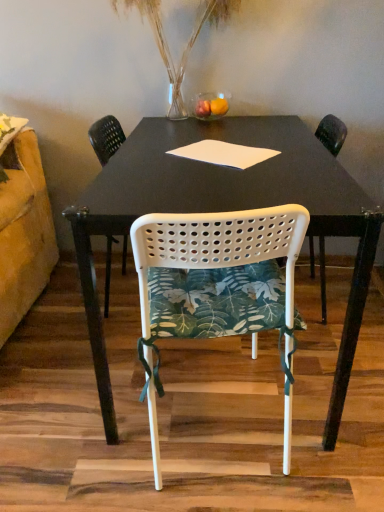
Question: Is white perforated plastic chair at center, placed as the 1th chair when sorted from back to front, bigger or smaller than white matte table at center?

Choices:
 (A) big
 (B) small

Answer: (B)

Question: From the image's perspective, is white perforated plastic chair at center, the 2th chair positioned from the front, above or below white matte table at center?

Choices:
 (A) below
 (B) above

Answer: (B)

Question: Considering the real-world distances, which object is closest to the white paper at center?

Choices:
 (A) translucent glass vase at upper center
 (B) white perforated plastic chair at center, marked as the second chair in a back-to-front arrangement
 (C) white matte table at center
 (D) white perforated plastic chair at center, the 2th chair positioned from the front

Answer: (C)

Question: Which object is the closest to the white matte table at center?

Choices:
 (A) white perforated plastic chair at center, placed as the 1th chair when sorted from back to front
 (B) white paper at center
 (C) white perforated plastic chair at center, the 1th chair from the front
 (D) translucent glass vase at upper center

Answer: (B)